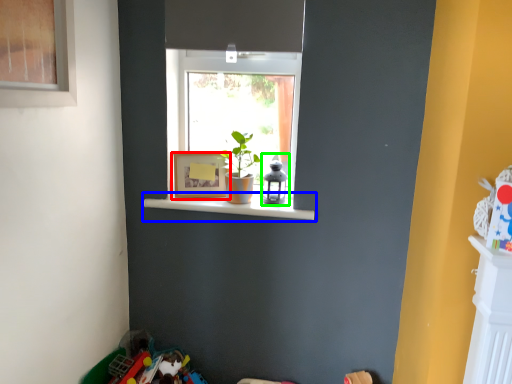
Question: Which object is the closest to the picture frame (highlighted by a red box)? Choose among these: window sill (highlighted by a blue box) or toy (highlighted by a green box).

Choices:
 (A) window sill
 (B) toy

Answer: (A)